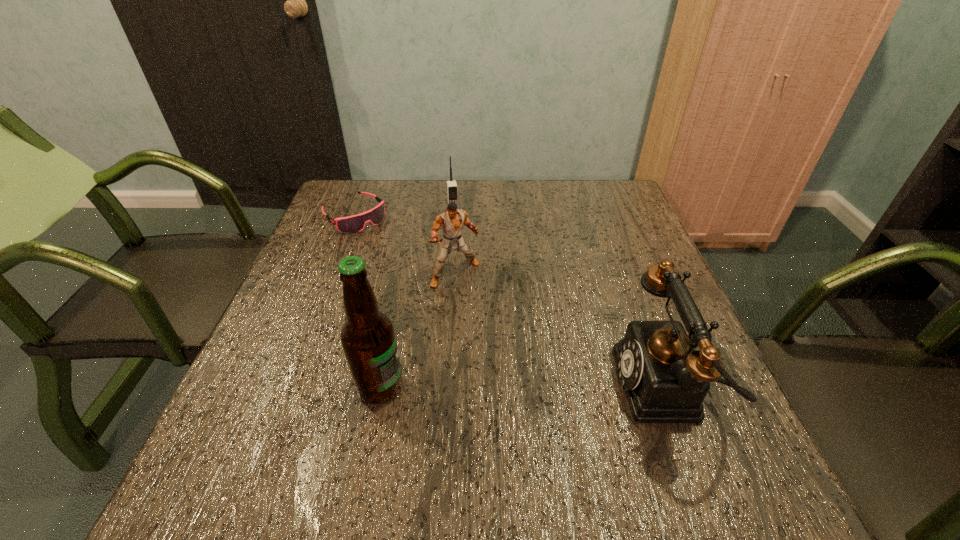
Where is `free space at the left edge`? The height and width of the screenshot is (540, 960). free space at the left edge is located at coordinates (332, 227).

Where is `free location at the right edge of the desktop`? The height and width of the screenshot is (540, 960). free location at the right edge of the desktop is located at coordinates (593, 253).

At what (x,y) coordinates should I click in order to perform the action: click on free space at the far left corner of the desktop. Please return your answer as a coordinate pair (x, y). Looking at the image, I should click on (348, 193).

This screenshot has width=960, height=540. Find the location of `vacant region at the far right corner`. vacant region at the far right corner is located at coordinates (592, 187).

Locate an element on the screen. The image size is (960, 540). vacant area at the near right corner of the desktop is located at coordinates (657, 427).

In order to click on blank region between the third nearest object and the shortest object in this screenshot , I will do `click(405, 245)`.

At what (x,y) coordinates should I click in order to perform the action: click on empty location between the third farthest object and the second object from left to right. Please return your answer as a coordinate pair (x, y). Looking at the image, I should click on (418, 330).

In order to click on empty location between the telephone and the cellular telephone in this screenshot , I will do tap(559, 302).

The image size is (960, 540). I want to click on free space between the puncher and the second object from left to right, so click(418, 330).

You are a GUI agent. You are given a task and a screenshot of the screen. Output one action in this format:
    pyautogui.click(x=<x>, y=<y>)
    Task: Click on the free space between the cellular telephone and the goggles
    Image resolution: width=960 pixels, height=540 pixels.
    Given the screenshot: What is the action you would take?
    pyautogui.click(x=404, y=216)